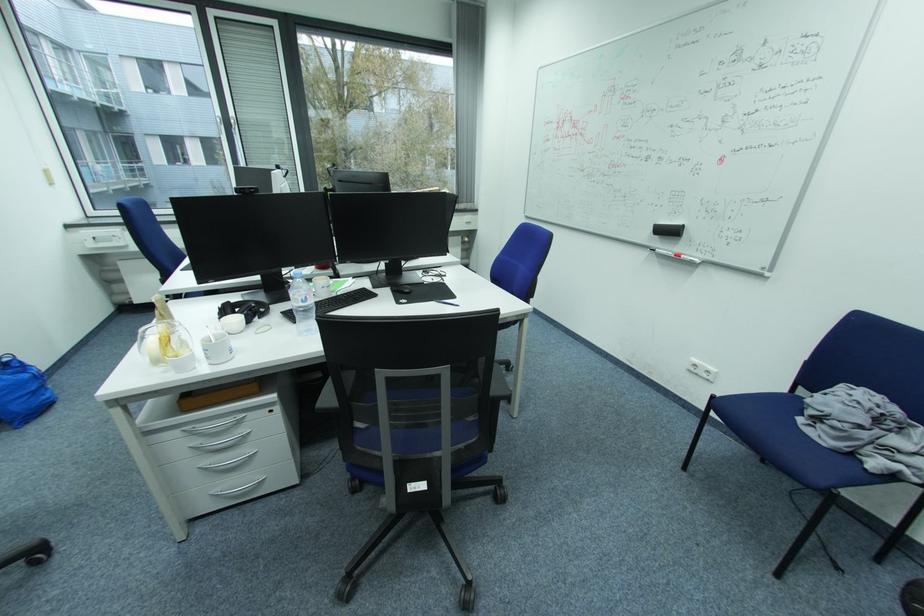
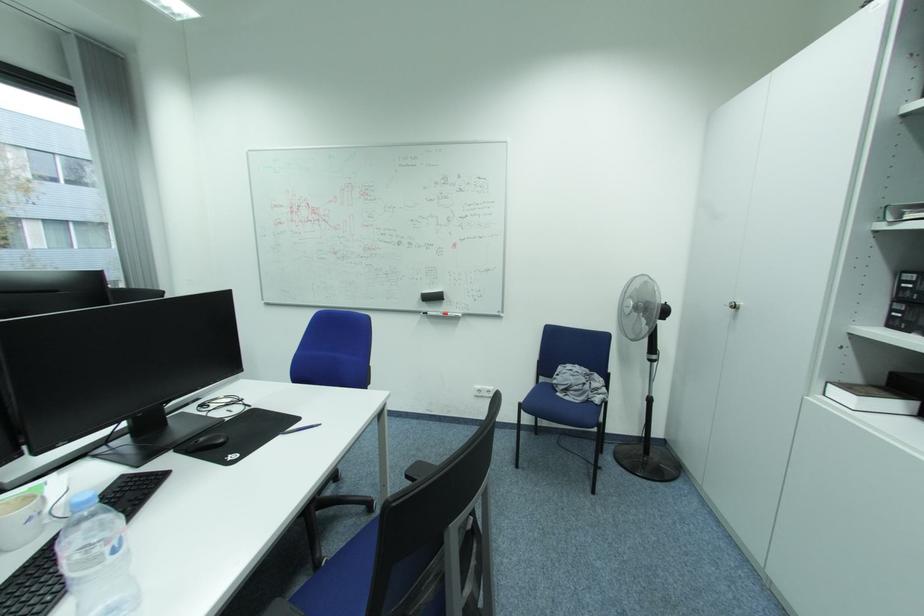
Question: How did the camera likely rotate?

Choices:
 (A) Left
 (B) Right
 (C) Up
 (D) Down

Answer: (B)